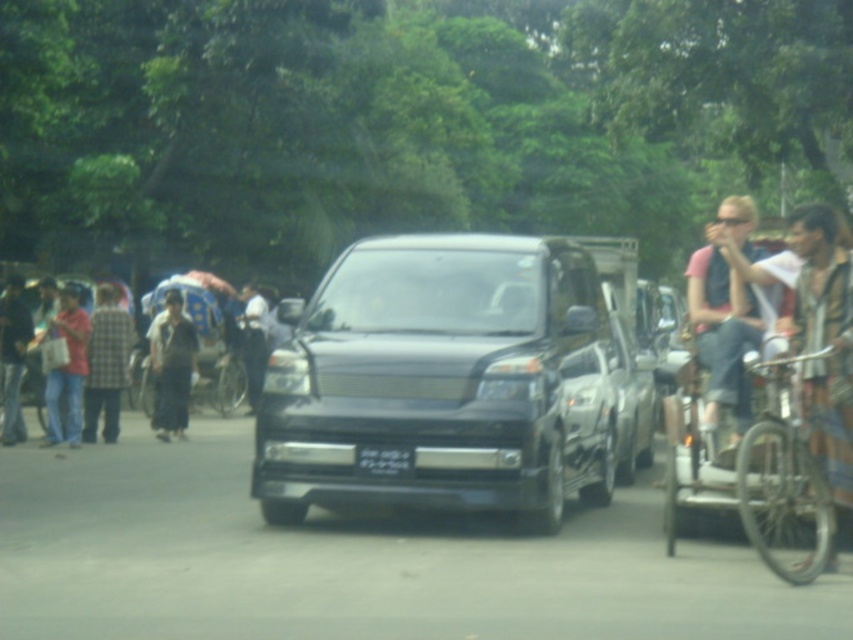
You are a fashion designer observing the street scene. You notice two people wearing denim jeans at right and plaid fabric shirt at left. Which clothing item appears larger in size?

The denim jeans at right is bigger than plaid fabric shirt at left.

Based on the coordinates provided, where is the metallic silver bicycle at center located in the image?

The metallic silver bicycle at center is located at point coordinates of 0.594 in the x axis and 0.258 in the y axis.